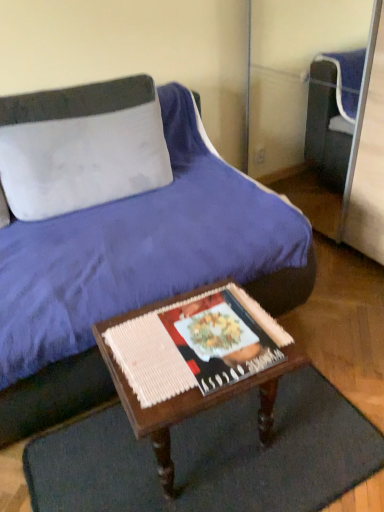
Image resolution: width=384 pixels, height=512 pixels. Find the location of `free space above dark brown woven mat at lower center (from a real-world perspective)`. free space above dark brown woven mat at lower center (from a real-world perspective) is located at coordinates (207, 452).